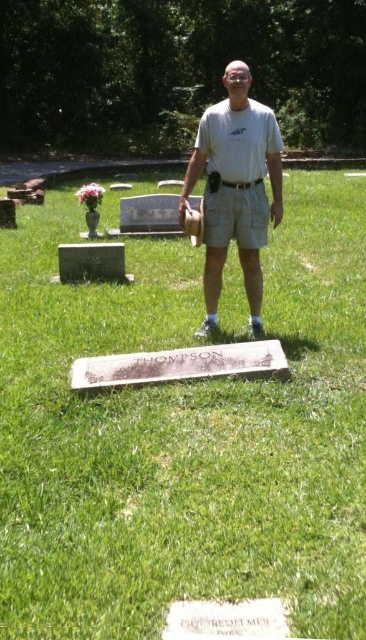
Question: Is green grass at center closer to camera compared to green marble gravestone at center?

Choices:
 (A) yes
 (B) no

Answer: (A)

Question: Among these objects, which one is nearest to the camera?

Choices:
 (A) white cotton shirt at center
 (B) green grass at center
 (C) green marble gravestone at center

Answer: (B)

Question: Does green grass at center appear over white cotton shirt at center?

Choices:
 (A) yes
 (B) no

Answer: (B)

Question: Which of these objects is positioned farthest from the white cotton shirt at center?

Choices:
 (A) green marble gravestone at center
 (B) green grass at center

Answer: (A)

Question: Which object is positioned closest to the white cotton shirt at center?

Choices:
 (A) green grass at center
 (B) green marble gravestone at center

Answer: (A)

Question: Is white cotton shirt at center to the right of green marble gravestone at center from the viewer's perspective?

Choices:
 (A) yes
 (B) no

Answer: (A)